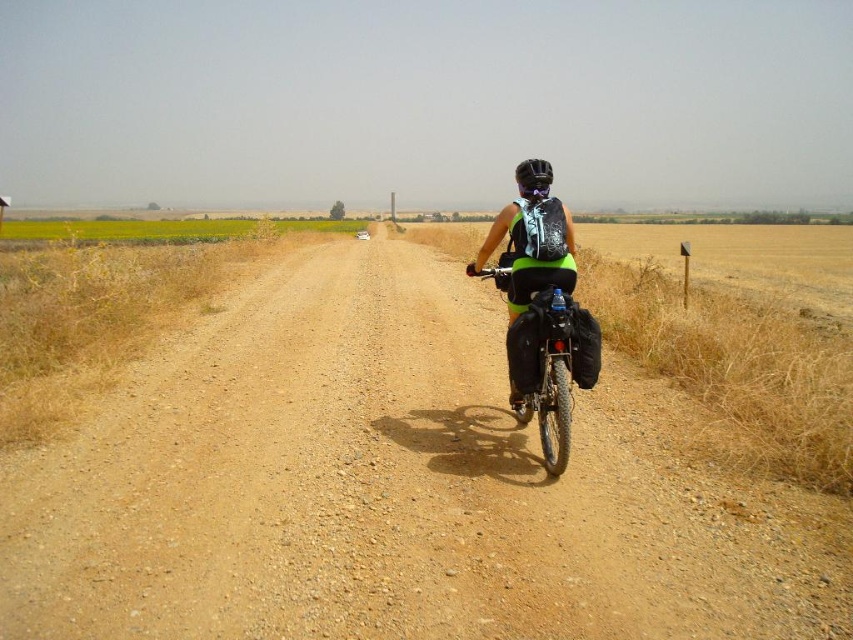
Can you confirm if matte black backpack at center is bigger than green fabric bicycle at center?

Correct, matte black backpack at center is larger in size than green fabric bicycle at center.

Looking at this image, between matte black backpack at center and green fabric bicycle at center, which one has less height?

green fabric bicycle at center

Who is more forward, (572, 259) or (564, 330)?

Point (564, 330) is more forward.

What are the coordinates of `matte black backpack at center` in the screenshot? It's located at (531, 240).

Is point (351, 509) farther from camera compared to point (509, 278)?

No, (351, 509) is closer to viewer.

Is brown gravel dirt track at center positioned behind green fabric bicycle at center?

No, it is not.

Between point (752, 588) and point (554, 432), which one is positioned behind?

Positioned behind is point (554, 432).

The image size is (853, 640). I want to click on brown gravel dirt track at center, so click(x=396, y=488).

Looking at this image, is brown gravel dirt track at center further to the viewer compared to matte black backpack at center?

No.

Is brown gravel dirt track at center below matte black backpack at center?

Yes.

Where is `brown gravel dirt track at center`? brown gravel dirt track at center is located at coordinates (396, 488).